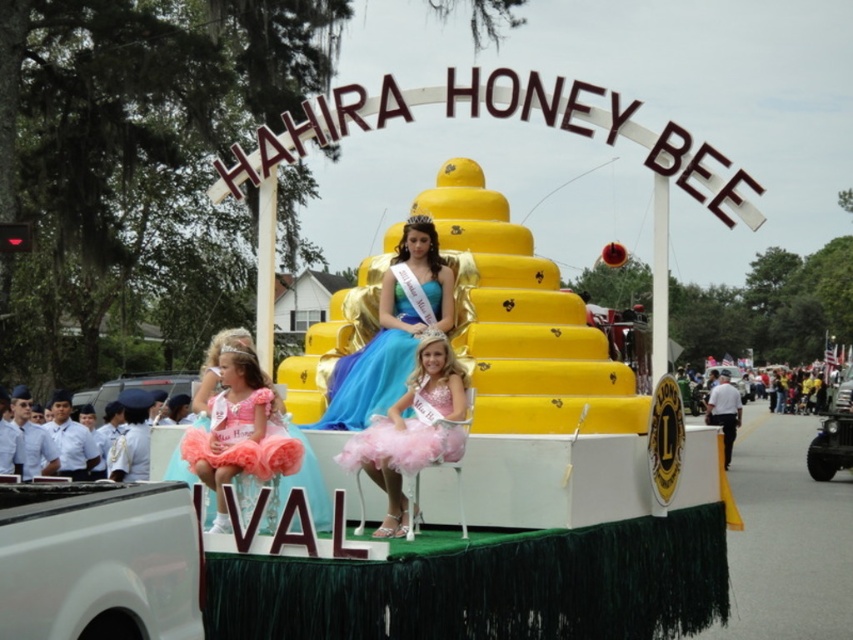
Which is more to the right, teal satin gown at center or pink tulle dress at center?

From the viewer's perspective, pink tulle dress at center appears more on the right side.

Is teal satin gown at center wider than pink tulle dress at center?

Yes, teal satin gown at center is wider than pink tulle dress at center.

Which is in front, point (393, 333) or point (451, 438)?

Point (451, 438) is in front.

In order to click on teal satin gown at center in this screenshot , I will do `click(392, 332)`.

Consider the image. Is pastel pink tulle dress at center behind pink tulle dress at lower left?

No, pastel pink tulle dress at center is in front of pink tulle dress at lower left.

Is point (392, 464) positioned after point (245, 445)?

Yes, it is behind point (245, 445).

Where is `pastel pink tulle dress at center`? The image size is (853, 640). pastel pink tulle dress at center is located at coordinates (412, 429).

At what (x,y) coordinates should I click in order to perform the action: click on pastel pink tulle dress at center. Please return your answer as a coordinate pair (x, y). Image resolution: width=853 pixels, height=640 pixels. Looking at the image, I should click on (412, 429).

Does pink tulle tutu at lower left lie in front of pastel pink tulle dress at center?

Yes, it is in front of pastel pink tulle dress at center.

Which is above, pink tulle tutu at lower left or pastel pink tulle dress at center?

pastel pink tulle dress at center is above.

Is point (230, 476) positioned behind point (373, 467)?

No, (230, 476) is closer to viewer.

Find the location of `pink tulle tutu at lower left`. pink tulle tutu at lower left is located at coordinates (241, 432).